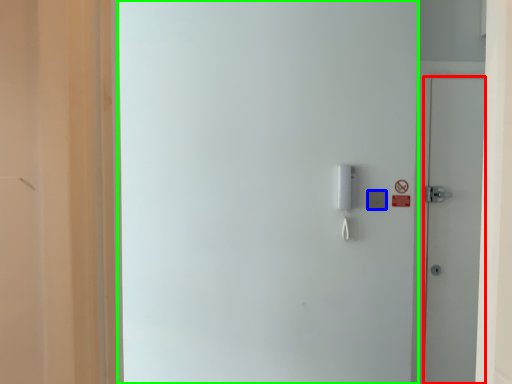
Question: Which object is the closest to the door (highlighted by a red box)? Choose among these: light switch (highlighted by a blue box) or screen door (highlighted by a green box).

Choices:
 (A) light switch
 (B) screen door

Answer: (A)